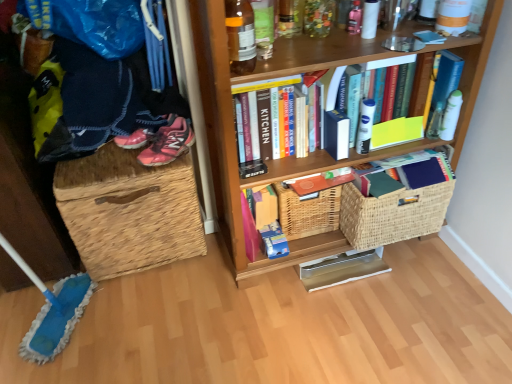
Question: From the image's perspective, does woven straw laundry basket at left appear lower than pink matte book at center, the second book positioned from the bottom?

Choices:
 (A) no
 (B) yes

Answer: (A)

Question: Does woven straw laundry basket at left have a lesser width compared to pink matte book at center, the 2th book when ordered from top to bottom?

Choices:
 (A) no
 (B) yes

Answer: (A)

Question: Does woven straw laundry basket at left come in front of pink matte book at center, the 2th book when ordered from top to bottom?

Choices:
 (A) yes
 (B) no

Answer: (A)

Question: From a real-world perspective, is woven straw laundry basket at left physically above pink matte book at center, the 2th book when ordered from top to bottom?

Choices:
 (A) no
 (B) yes

Answer: (A)

Question: Considering the relative sizes of woven straw laundry basket at left and pink matte book at center, the second book positioned from the bottom, in the image provided, is woven straw laundry basket at left wider than pink matte book at center, the second book positioned from the bottom,?

Choices:
 (A) no
 (B) yes

Answer: (B)

Question: In the image, is pink matte book at center, the second book positioned from the bottom, positioned in front of or behind hardcover books at upper center, which is counted as the 1th book, starting from the top?

Choices:
 (A) front
 (B) behind

Answer: (B)

Question: In terms of width, does pink matte book at center, the second book positioned from the bottom, look wider or thinner when compared to hardcover books at upper center, which is counted as the 1th book, starting from the top?

Choices:
 (A) thin
 (B) wide

Answer: (A)

Question: From a real-world perspective, is pink matte book at center, the second book positioned from the bottom, positioned above or below hardcover books at upper center, which ranks as the third book in bottom-to-top order?

Choices:
 (A) below
 (B) above

Answer: (A)

Question: Looking at the image, does pink matte book at center, the second book positioned from the bottom, seem bigger or smaller compared to hardcover books at upper center, which ranks as the third book in bottom-to-top order?

Choices:
 (A) big
 (B) small

Answer: (B)

Question: Is woven straw laundry basket at left taller or shorter than translucent glass bottle at upper center?

Choices:
 (A) tall
 (B) short

Answer: (A)

Question: In the image, is woven straw laundry basket at left positioned in front of or behind translucent glass bottle at upper center?

Choices:
 (A) behind
 (B) front

Answer: (A)

Question: Looking at their shapes, would you say woven straw laundry basket at left is wider or thinner than translucent glass bottle at upper center?

Choices:
 (A) thin
 (B) wide

Answer: (B)

Question: Based on their positions, is woven straw laundry basket at left located to the left or right of translucent glass bottle at upper center?

Choices:
 (A) right
 (B) left

Answer: (B)

Question: Would you say hardcover books at upper center, which is counted as the 1th book, starting from the top, is to the left or to the right of pink mesh sneakers at left in the picture?

Choices:
 (A) left
 (B) right

Answer: (B)

Question: Considering the positions of hardcover books at upper center, which ranks as the third book in bottom-to-top order, and pink mesh sneakers at left in the image, is hardcover books at upper center, which ranks as the third book in bottom-to-top order, wider or thinner than pink mesh sneakers at left?

Choices:
 (A) wide
 (B) thin

Answer: (B)